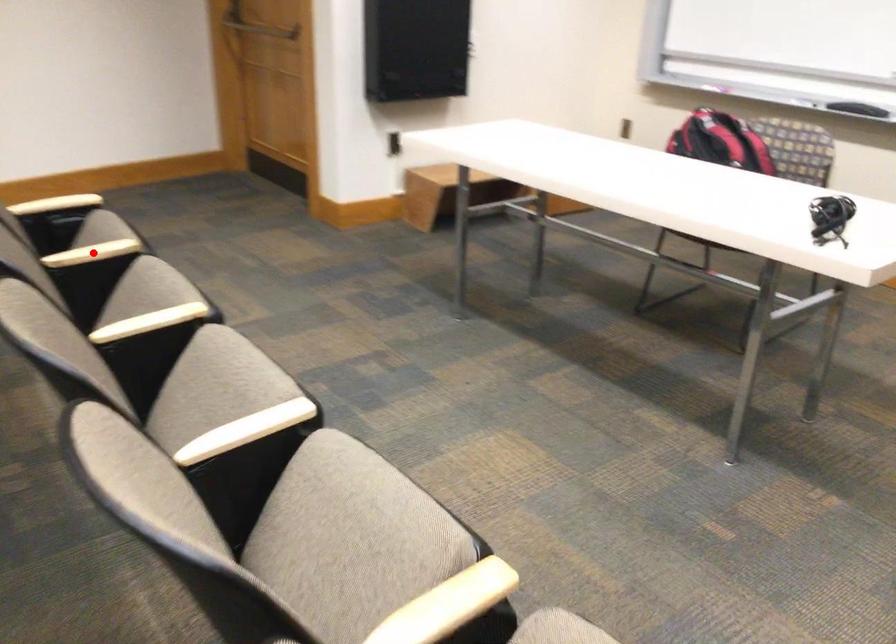
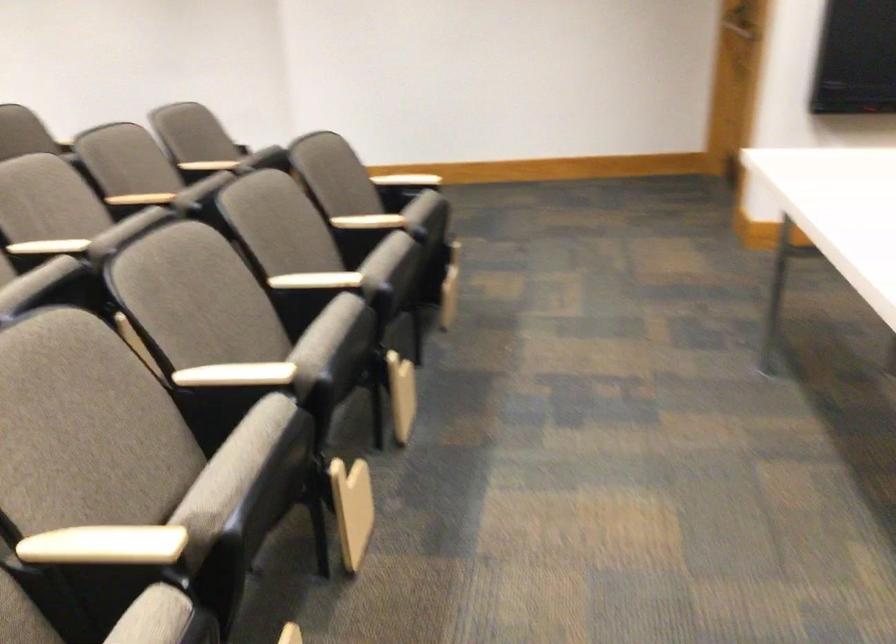
Question: I am providing you with two images of the same scene from different viewpoints. A red point is marked on the first image. Can you still see the location of the red point in image 2?

Choices:
 (A) Yes
 (B) No

Answer: (B)